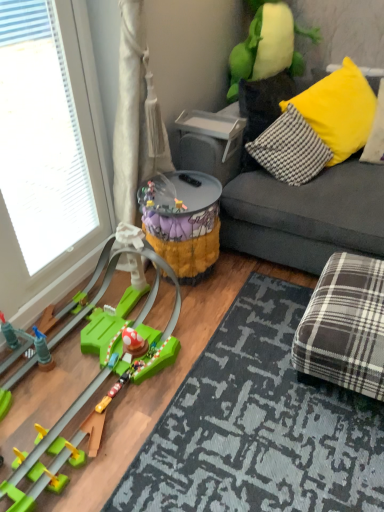
Where is `empty space that is ontop of plaid fabric mat at lower right`? Image resolution: width=384 pixels, height=512 pixels. empty space that is ontop of plaid fabric mat at lower right is located at coordinates (275, 419).